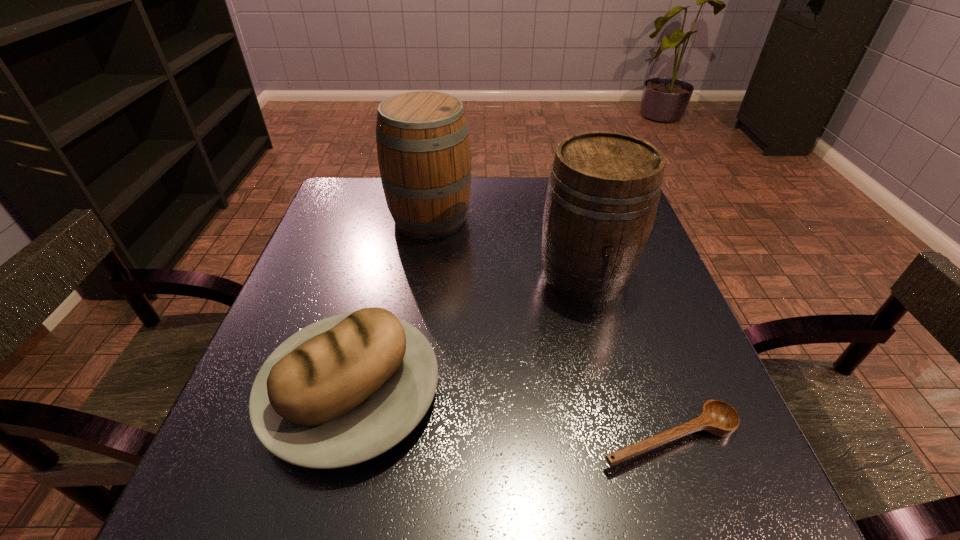
This screenshot has width=960, height=540. What are the coordinates of `vacant space at the left edge` in the screenshot? It's located at (362, 265).

This screenshot has width=960, height=540. In order to click on blank area at the right edge in this screenshot , I will do `click(655, 403)`.

What are the coordinates of `vacant space at the far left corner` in the screenshot? It's located at (354, 207).

At what (x,y) coordinates should I click in order to perform the action: click on free space at the near left corner. Please return your answer as a coordinate pair (x, y). This screenshot has width=960, height=540. Looking at the image, I should click on (270, 512).

Find the location of a particular element. The width and height of the screenshot is (960, 540). unoccupied position between the second farthest object and the shortest object is located at coordinates (627, 356).

Image resolution: width=960 pixels, height=540 pixels. What are the coordinates of `free space between the third tallest object and the wooden spoon` in the screenshot? It's located at (510, 415).

In order to click on free space between the third nearest object and the left cider in this screenshot , I will do `click(508, 246)`.

Where is `free spot between the farther cider and the bread`? The height and width of the screenshot is (540, 960). free spot between the farther cider and the bread is located at coordinates (391, 305).

This screenshot has height=540, width=960. In order to click on vacant space in between the bread and the left cider in this screenshot , I will do `click(391, 305)`.

Where is `vacant region between the bread and the right cider`? vacant region between the bread and the right cider is located at coordinates (468, 333).